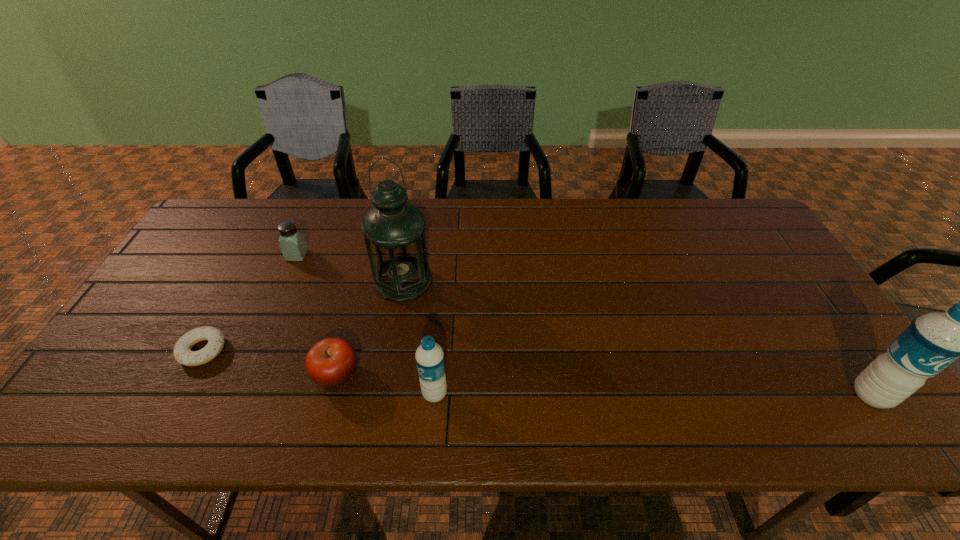
This screenshot has height=540, width=960. I want to click on the left water bottle, so click(x=429, y=356).

Image resolution: width=960 pixels, height=540 pixels. I want to click on the third tallest object, so click(429, 356).

You are a GUI agent. You are given a task and a screenshot of the screen. Output one action in this format:
    pyautogui.click(x=<x>, y=<y>)
    Task: Click on the rightmost object
    
    Given the screenshot: What is the action you would take?
    pyautogui.click(x=932, y=342)

Where is `the right water bottle`? the right water bottle is located at coordinates (932, 342).

Where is `saltshaker`? The height and width of the screenshot is (540, 960). saltshaker is located at coordinates (292, 243).

Identify the location of oil lamp. (393, 229).

At what (x,y) coordinates should I click in order to perform the action: click on the shortest object. Please return your answer as a coordinate pair (x, y). Looking at the image, I should click on (182, 352).

The height and width of the screenshot is (540, 960). I want to click on doughnut, so click(x=182, y=352).

Where is `apple`? apple is located at coordinates (331, 362).

Locate an element on the screen. Image resolution: width=960 pixels, height=540 pixels. vacant space located 0.240m on the label of the shorter water bottle is located at coordinates (318, 394).